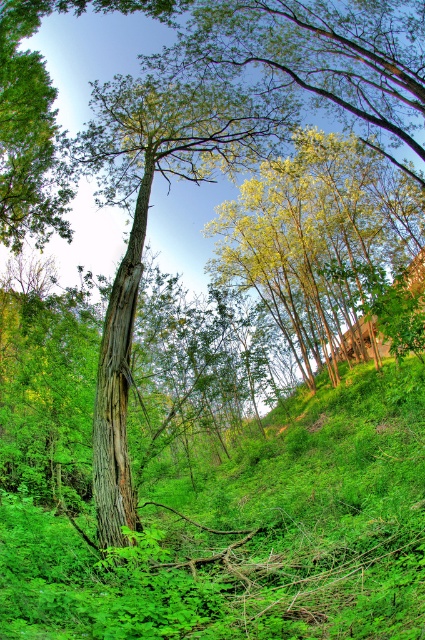
Does green bark tree at center lie behind brown rough bark tree trunk at center?

No, it is in front of brown rough bark tree trunk at center.

Locate an element on the screen. green bark tree at center is located at coordinates (146, 225).

Between point (102, 499) and point (129, 330), which one is positioned in front?

Point (102, 499) is more forward.

Locate an element on the screen. Image resolution: width=425 pixels, height=640 pixels. green bark tree at center is located at coordinates (146, 225).

Which is behind, point (289, 634) or point (99, 435)?

The point (99, 435) is behind.

Is the position of green leafy grass at center less distant than that of green bark tree at center?

Yes.

Which is behind, point (11, 621) or point (187, 86)?

Point (187, 86)

Image resolution: width=425 pixels, height=640 pixels. I want to click on green leafy grass at center, so click(251, 536).

Looking at this image, who is more distant from viewer, (411,515) or (138,198)?

The point (138,198) is behind.

Is point (88, 602) more distant than point (98, 536)?

No, it is not.

Locate an element on the screen. The image size is (425, 640). green leafy grass at center is located at coordinates 251,536.